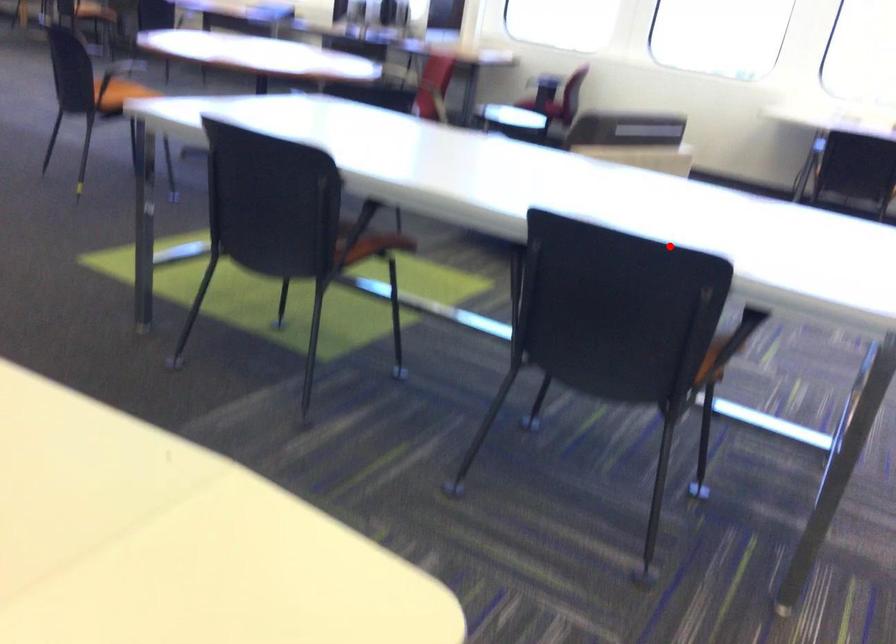
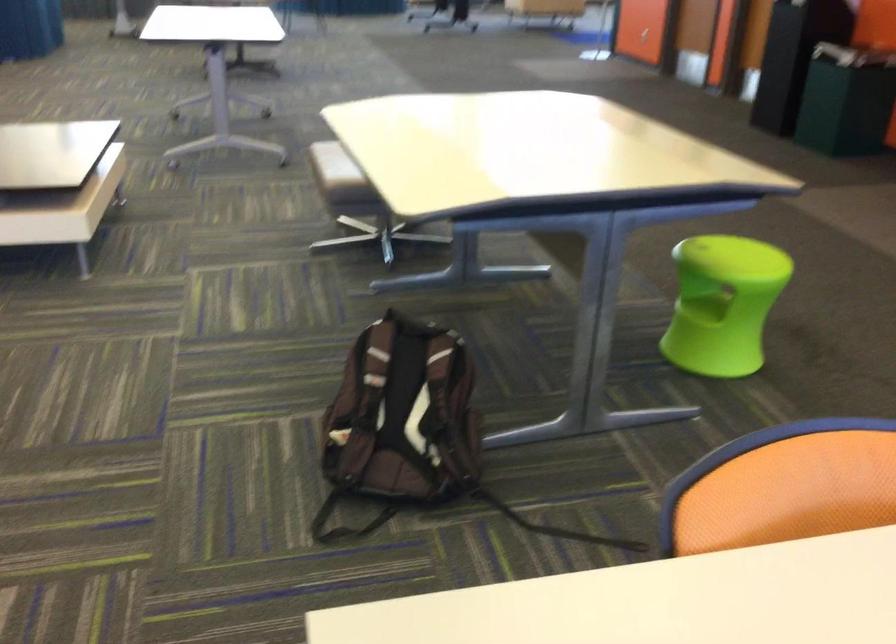
Find the pixel in the second image that matches the highlighted location in the first image.

(832, 585)